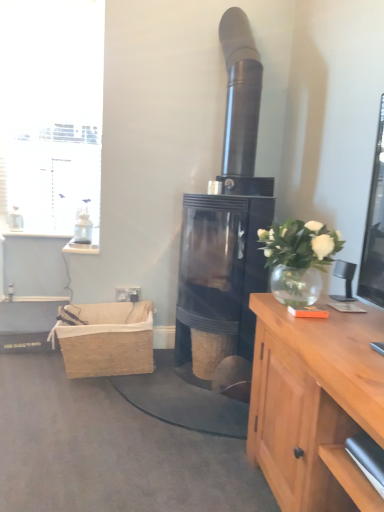
The width and height of the screenshot is (384, 512). Identify the location of free spot in front of burlap picnic basket at lower left. point(96,398).